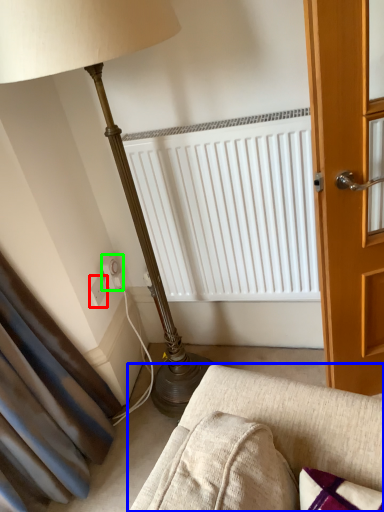
Question: Based on their relative distances, which object is farther from electric outlet (highlighted by a red box)? Choose from studio couch (highlighted by a blue box) and electric outlet (highlighted by a green box).

Choices:
 (A) studio couch
 (B) electric outlet

Answer: (A)